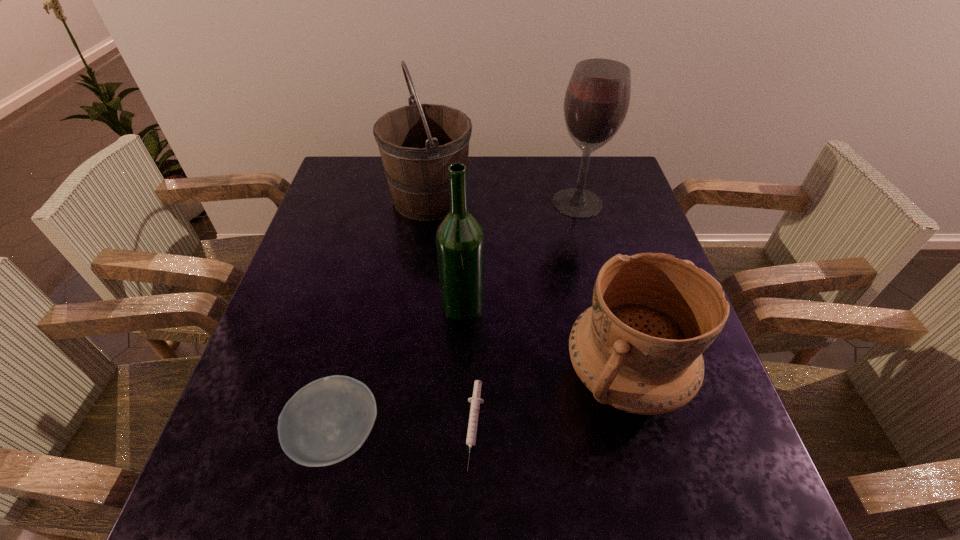
This screenshot has width=960, height=540. I want to click on object at the far right corner, so click(596, 102).

The width and height of the screenshot is (960, 540). I want to click on free space at the far edge of the desktop, so click(x=567, y=165).

I want to click on free region at the near edge, so click(398, 526).

Locate an element on the screen. This screenshot has width=960, height=540. free region at the left edge of the desktop is located at coordinates tap(356, 201).

The height and width of the screenshot is (540, 960). I want to click on vacant region at the far left corner, so coord(354,183).

The height and width of the screenshot is (540, 960). I want to click on vacant area at the far right corner, so click(x=588, y=188).

Image resolution: width=960 pixels, height=540 pixels. In the image, there is a desktop. Find the location of `vacant space at the near right corner`. vacant space at the near right corner is located at coordinates (692, 477).

The image size is (960, 540). In order to click on vacant region between the fourth nearest object and the shortest object in this screenshot , I will do `click(469, 365)`.

Identify the location of blank region between the farther alcohol and the bucket. The height and width of the screenshot is (540, 960). (504, 200).

Locate an element on the screen. unoccupied position between the nearer alcohol and the pottery is located at coordinates (543, 340).